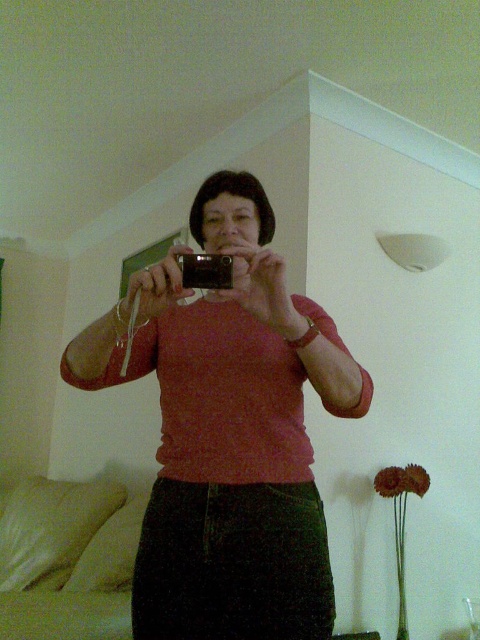
You are an interior designer analyzing the composition of the scene. Based on the coordinates provided, where is the matte pink sweater at center located in the image?

The matte pink sweater at center is located at the coordinates point (228,433) in the image.

You are helping someone take a selfie and notice they are wearing a matte pink sweater at center and holding a black plastic camera at center. Which item is positioned to the right when viewed from the front?

The black plastic camera at center is to the right of the matte pink sweater at center.